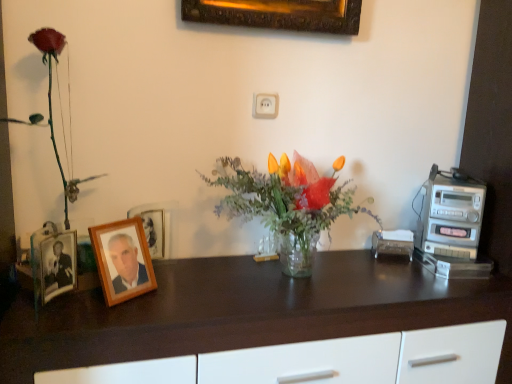
Locate an element on the screen. The image size is (512, 384). vacant area that is in front of matte plastic rose at left is located at coordinates (44, 311).